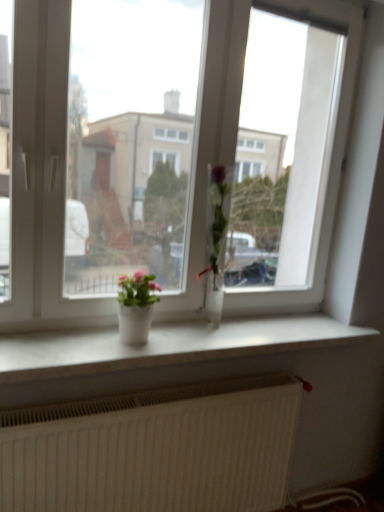
Question: In terms of size, does white marble window sill at center appear bigger or smaller than clear glass vase at center, which is counted as the 2th houseplant, starting from the left?

Choices:
 (A) small
 (B) big

Answer: (B)

Question: Looking at their shapes, would you say white marble window sill at center is wider or thinner than clear glass vase at center, marked as the first houseplant in a right-to-left arrangement?

Choices:
 (A) thin
 (B) wide

Answer: (B)

Question: Considering the real-world distances, which object is closest to the matte white pot at center, which is the second houseplant in right-to-left order?

Choices:
 (A) white marble window sill at center
 (B) white textured radiator at lower center
 (C) transparent glass window at center
 (D) clear glass vase at center, which is counted as the 2th houseplant, starting from the left

Answer: (A)

Question: Based on their relative distances, which object is farther from the white textured radiator at lower center?

Choices:
 (A) clear glass vase at center, which is counted as the 2th houseplant, starting from the left
 (B) matte white pot at center, arranged as the first houseplant when viewed from the left
 (C) white marble window sill at center
 (D) transparent glass window at center

Answer: (D)